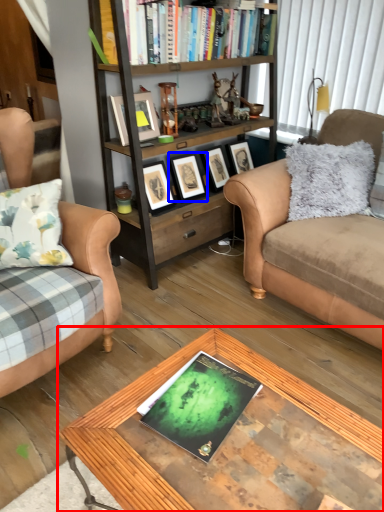
Question: Which point is further to the camera, coffee table (highlighted by a red box) or picture frame (highlighted by a blue box)?

Choices:
 (A) coffee table
 (B) picture frame

Answer: (B)